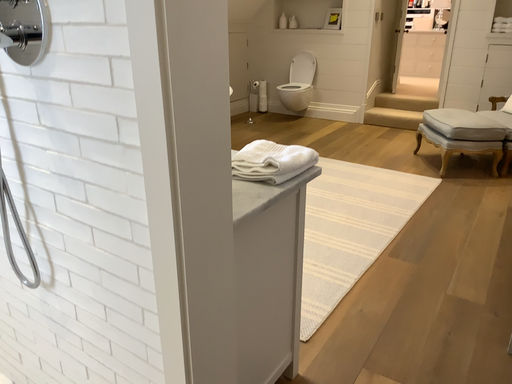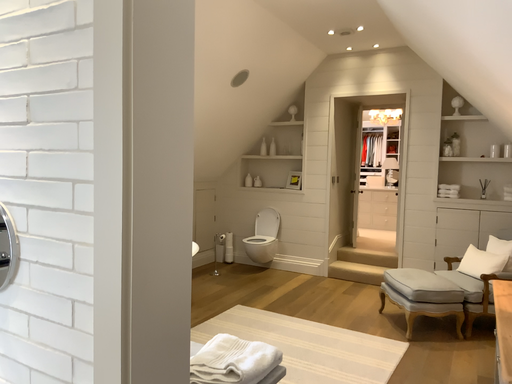
Question: How did the camera likely rotate when shooting the video?

Choices:
 (A) rotated downward
 (B) rotated upward

Answer: (B)